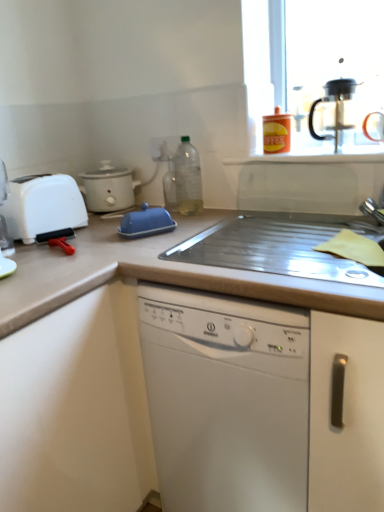
Locate an element on the screen. free spot to the right of orange matte coffee canister at upper right, which appears as the 2th kitchen appliance when viewed from the back is located at coordinates (332, 147).